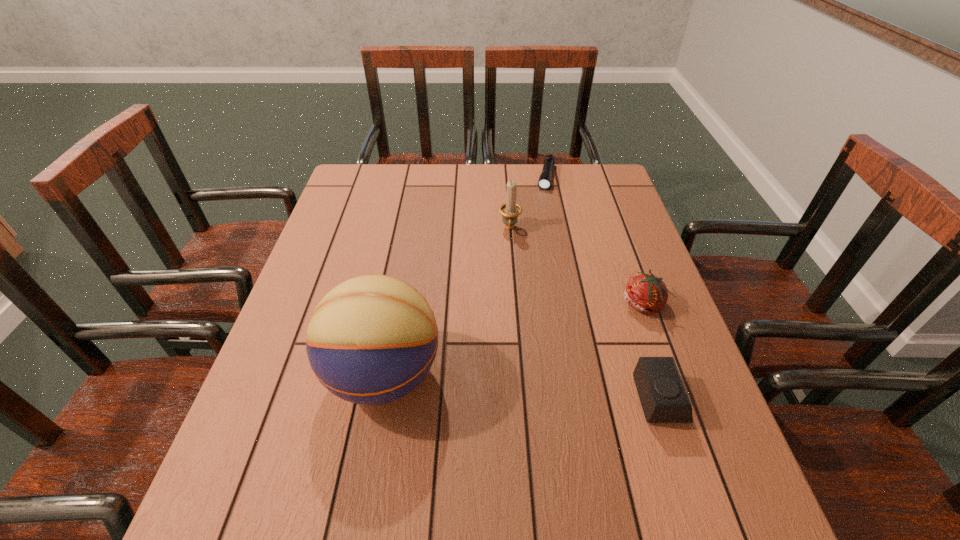
Where is `vacant space situated on the handle side of the fourth nearest object`? The image size is (960, 540). vacant space situated on the handle side of the fourth nearest object is located at coordinates coord(506,323).

In order to click on free space located 0.130m on the handle side of the fourth nearest object in this screenshot , I will do `click(508, 268)`.

Find the location of a particular element. The width and height of the screenshot is (960, 540). free space located on the front-facing side of the tomato is located at coordinates (528, 384).

This screenshot has height=540, width=960. I want to click on vacant space located on the front-facing side of the tomato, so click(575, 351).

This screenshot has width=960, height=540. Find the location of `free region located 0.150m on the front-facing side of the tomato`. free region located 0.150m on the front-facing side of the tomato is located at coordinates (585, 345).

At what (x,y) coordinates should I click in order to perform the action: click on vacant space located 0.300m at the lens end of the shortest object. Please return your answer as a coordinate pair (x, y). Looking at the image, I should click on (534, 249).

Where is `vacant space located 0.130m at the lens end of the shortest object`? This screenshot has height=540, width=960. vacant space located 0.130m at the lens end of the shortest object is located at coordinates (541, 214).

This screenshot has width=960, height=540. In order to click on free space located at the lens end of the shortest object in this screenshot , I will do `click(536, 242)`.

Where is `object situated at the far edge`? object situated at the far edge is located at coordinates (544, 183).

Image resolution: width=960 pixels, height=540 pixels. In order to click on basketball that is at the near edge in this screenshot , I will do `click(371, 340)`.